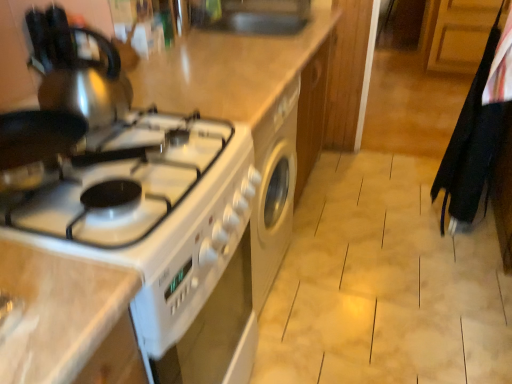
Question: Is white glossy stove at left oriented away from satin silver kettle at upper left?

Choices:
 (A) no
 (B) yes

Answer: (A)

Question: Are white glossy stove at left and satin silver kettle at upper left making contact?

Choices:
 (A) no
 (B) yes

Answer: (A)

Question: Is white glossy stove at left outside of satin silver kettle at upper left?

Choices:
 (A) no
 (B) yes

Answer: (B)

Question: From the image's perspective, does white glossy stove at left appear lower than satin silver kettle at upper left?

Choices:
 (A) no
 (B) yes

Answer: (B)

Question: Could you tell me if white glossy stove at left is turned towards satin silver kettle at upper left?

Choices:
 (A) no
 (B) yes

Answer: (A)

Question: Does point (493, 104) appear closer or farther from the camera than point (109, 89)?

Choices:
 (A) farther
 (B) closer

Answer: (A)

Question: Is black fabric laundry at right inside or outside of satin silver kettle at upper left?

Choices:
 (A) inside
 (B) outside

Answer: (B)

Question: Considering the positions of black fabric laundry at right and satin silver kettle at upper left in the image, is black fabric laundry at right wider or thinner than satin silver kettle at upper left?

Choices:
 (A) thin
 (B) wide

Answer: (A)

Question: Is black fabric laundry at right to the left or to the right of satin silver kettle at upper left in the image?

Choices:
 (A) right
 (B) left

Answer: (A)

Question: Is black fabric laundry at right to the left or to the right of white glossy stove at left in the image?

Choices:
 (A) right
 (B) left

Answer: (A)

Question: Is black fabric laundry at right spatially inside white glossy stove at left, or outside of it?

Choices:
 (A) inside
 (B) outside

Answer: (B)

Question: Does point coord(473,153) appear closer or farther from the camera than point coord(143,97)?

Choices:
 (A) farther
 (B) closer

Answer: (A)

Question: From a real-world perspective, is black fabric laundry at right positioned above or below white glossy stove at left?

Choices:
 (A) below
 (B) above

Answer: (B)

Question: Would you say white glossy stove at left is inside or outside black fabric laundry at right?

Choices:
 (A) outside
 (B) inside

Answer: (A)

Question: In terms of size, does white glossy stove at left appear bigger or smaller than black fabric laundry at right?

Choices:
 (A) big
 (B) small

Answer: (A)